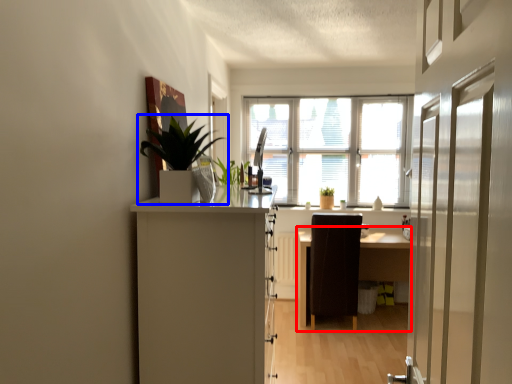
Question: Which of the following is the closest to the observer, table (highlighted by a red box) or houseplant (highlighted by a blue box)?

Choices:
 (A) table
 (B) houseplant

Answer: (B)